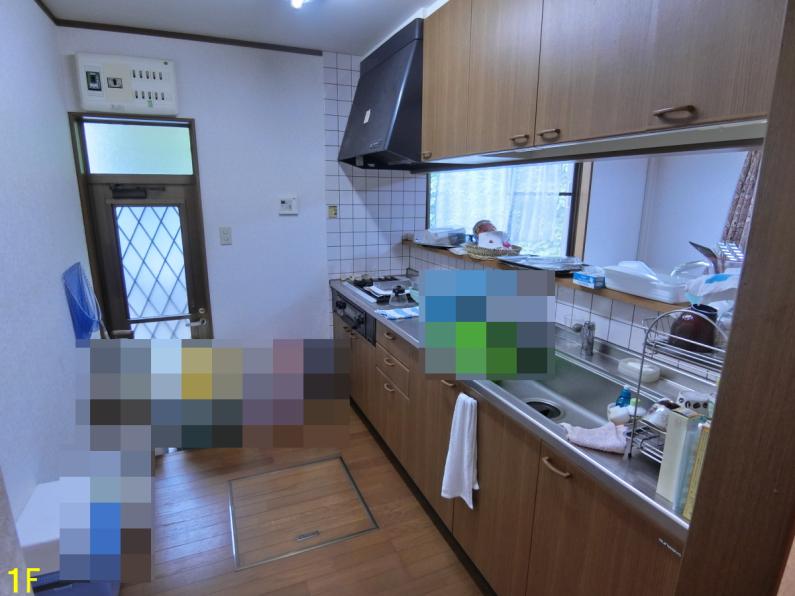
This screenshot has width=795, height=596. Identify the location of windows. (145, 151), (522, 212).